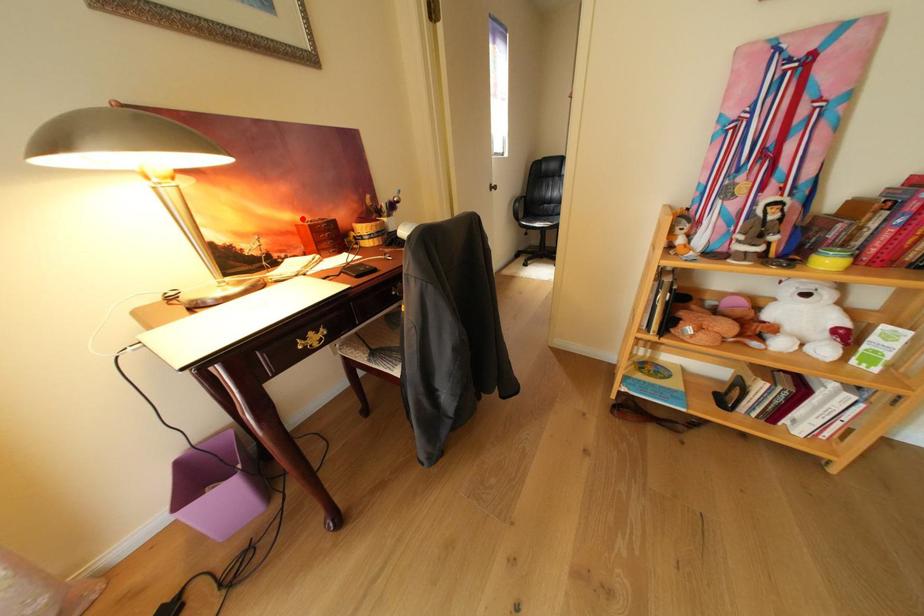
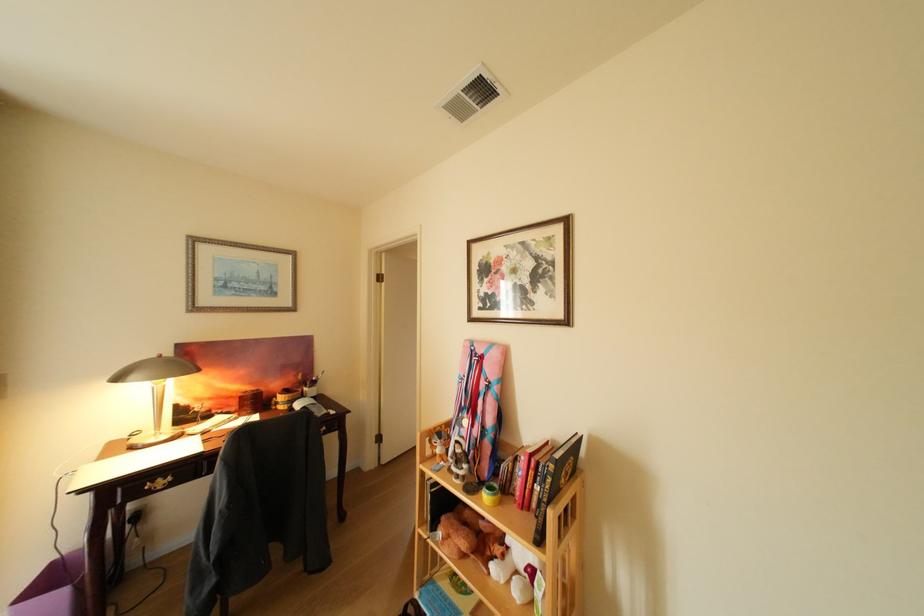
Question: I am providing you with two images of the same scene from different viewpoints. A red point is marked on the first image. Is the red point's position out of view in image 2?

Choices:
 (A) Yes
 (B) No

Answer: (B)